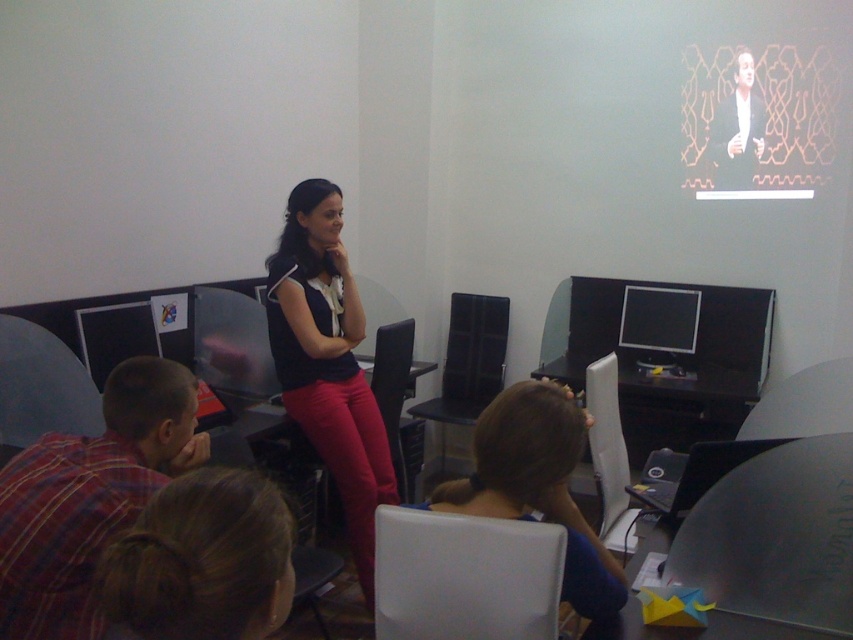
You are a student sitting in the classroom and want to look at the brown hair bun at lower center. In which direction should you turn your head to see it?

The brown hair bun at lower center is located at point (201, 561), so you should turn your head to the right to see it.

You are a student in the classroom and want to know which object is narrower between the plaid fabric shirt at lower left and the brown hair bun at lower center. Can you determine this?

The plaid fabric shirt at lower left is thinner than the brown hair bun at lower center, so the plaid fabric shirt at lower left is narrower.

You are a student in the classroom and want to look at the plaid fabric shirt at lower left and the matte black monitor at center right. Which object is positioned lower in the image?

The plaid fabric shirt at lower left is positioned below the matte black monitor at center right, so it is lower in the image.